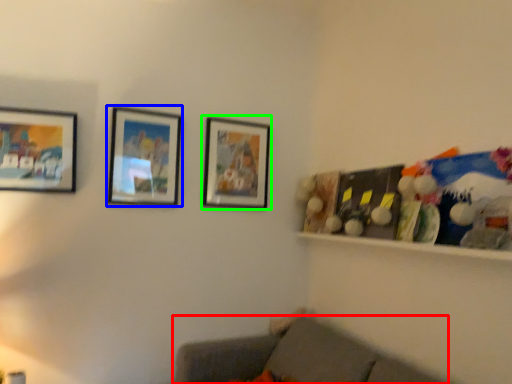
Question: Estimate the real-world distances between objects in this image. Which object is farther from studio couch (highlighted by a red box), picture frame (highlighted by a blue box) or picture frame (highlighted by a green box)?

Choices:
 (A) picture frame
 (B) picture frame

Answer: (A)